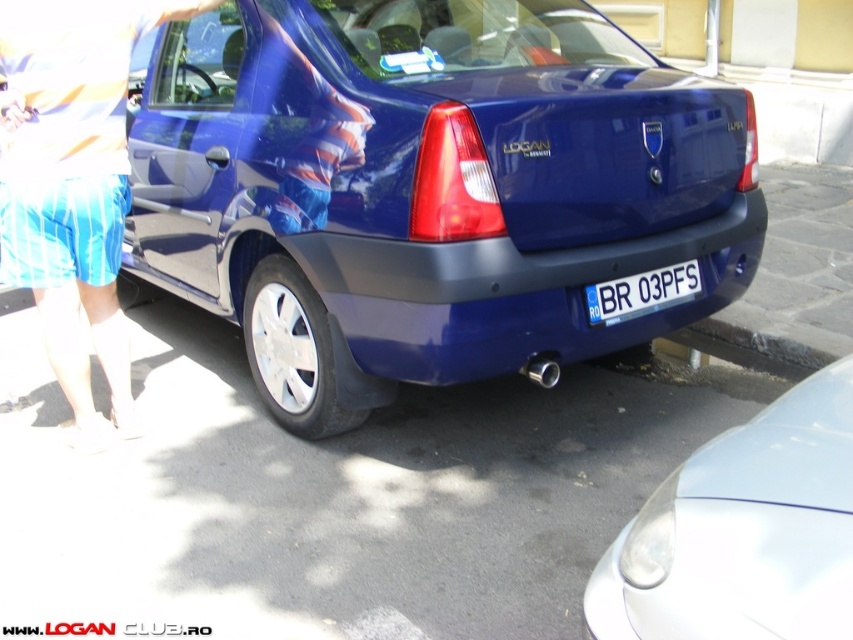
Question: Does blue striped shorts at lower left have a smaller size compared to white plastic license plate at center?

Choices:
 (A) no
 (B) yes

Answer: (A)

Question: Is glossy blue sedan at center smaller than white glossy car at lower right?

Choices:
 (A) no
 (B) yes

Answer: (A)

Question: Among these points, which one is farthest from the camera?

Choices:
 (A) (78, 358)
 (B) (612, 317)
 (C) (149, 90)
 (D) (625, 618)

Answer: (C)

Question: Which point is closer to the camera taking this photo?

Choices:
 (A) (631, 310)
 (B) (90, 310)
 (C) (190, 163)
 (D) (734, 588)

Answer: (D)

Question: Which object is closer to the camera taking this photo?

Choices:
 (A) white glossy car at lower right
 (B) white plastic license plate at center
 (C) glossy blue sedan at center

Answer: (A)

Question: Does glossy blue sedan at center come behind white plastic license plate at center?

Choices:
 (A) no
 (B) yes

Answer: (A)